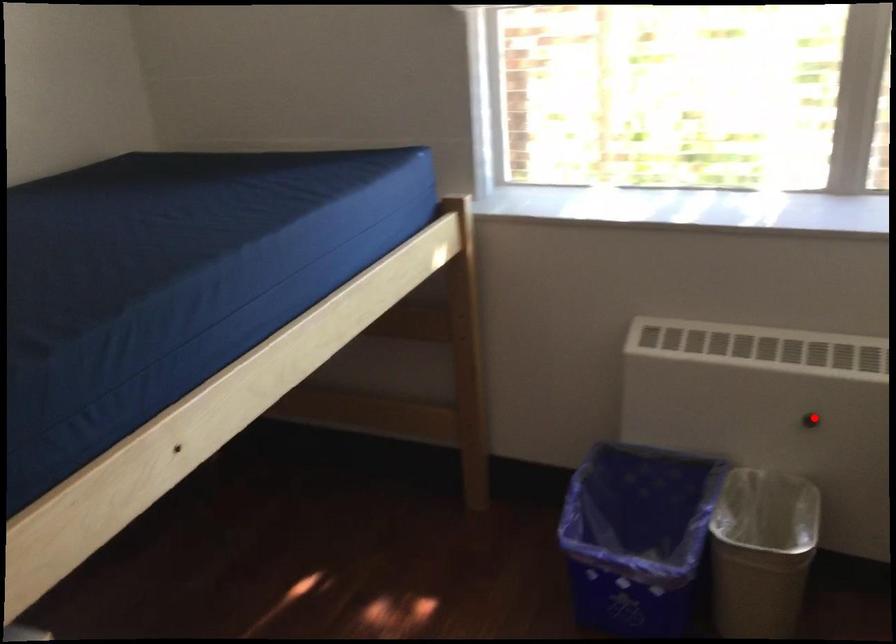
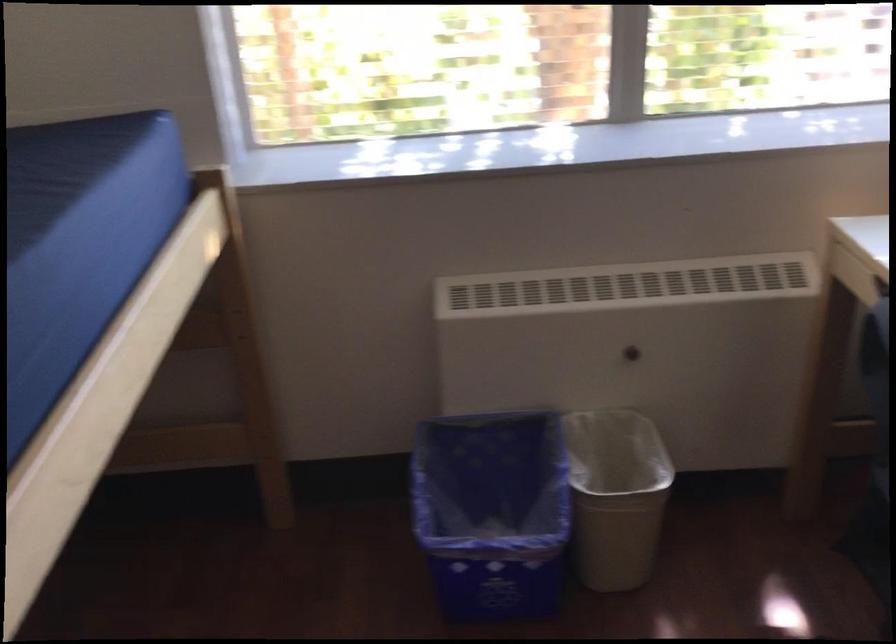
The point at the highlighted location is marked in the first image. Where is the corresponding point in the second image?

(634, 351)